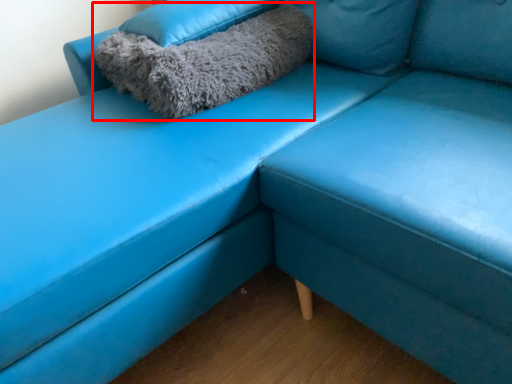
Question: Considering the relative positions of pillow (annotated by the red box) and pillow in the image provided, where is pillow (annotated by the red box) located with respect to the staircase?

Choices:
 (A) left
 (B) right

Answer: (A)